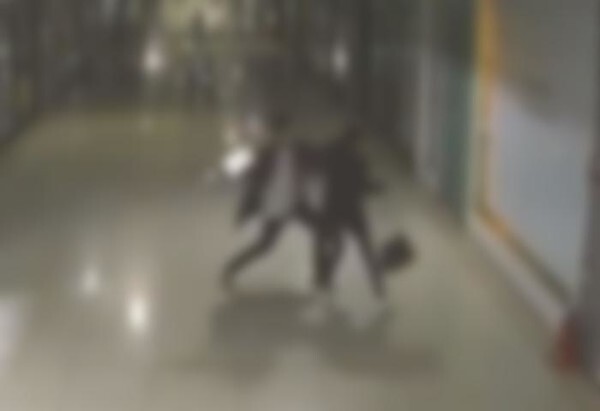
This screenshot has height=411, width=600. I want to click on floor, so [120, 144], [464, 310], [129, 357].